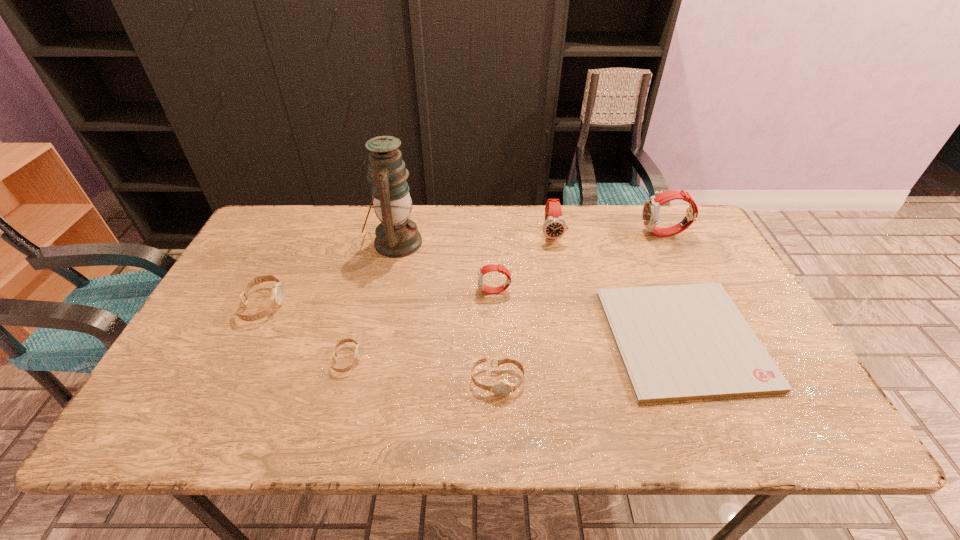
Locate an element on the screen. The width and height of the screenshot is (960, 540). vacant space in between the clipboard and the leftmost object is located at coordinates (473, 322).

Locate an element on the screen. This screenshot has width=960, height=540. free space between the second watch from left to right and the rightmost beige watch is located at coordinates (422, 370).

Find the location of a particular element. blank region between the leftmost watch and the shortest watch is located at coordinates (305, 333).

In order to click on vacant area between the second smallest red watch and the third tallest watch in this screenshot , I will do `click(523, 263)`.

I want to click on empty space that is in between the leftmost object and the tallest object, so tap(329, 274).

I want to click on vacant space that's between the third tallest watch and the tallest object, so click(x=444, y=267).

Locate an element on the screen. This screenshot has width=960, height=540. free space between the tallest object and the smallest beige watch is located at coordinates (372, 301).

Image resolution: width=960 pixels, height=540 pixels. I want to click on vacant space that is in between the second shortest object and the leftmost beige watch, so click(305, 333).

This screenshot has height=540, width=960. What are the coordinates of `free space between the leftmost object and the rightmost red watch` in the screenshot? It's located at (464, 269).

The width and height of the screenshot is (960, 540). In order to click on object that can be found as the seventh closest to the second beige watch from right to left in this screenshot , I will do `click(650, 214)`.